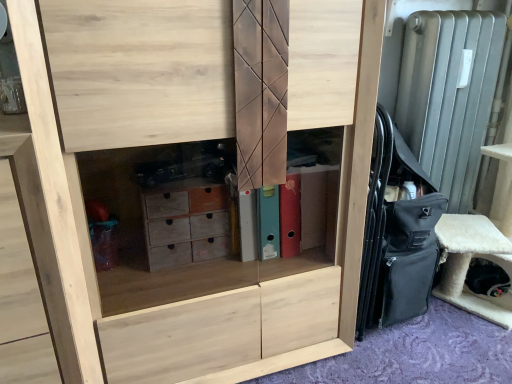
Find the location of a particular element. Image resolution: width=512 pixels, height=384 pixels. black fabric bag at right is located at coordinates (397, 235).

What do you see at coordinates (397, 235) in the screenshot?
I see `black fabric bag at right` at bounding box center [397, 235].

Locate an element on the screen. The image size is (512, 384). black fabric bag at right is located at coordinates (397, 235).